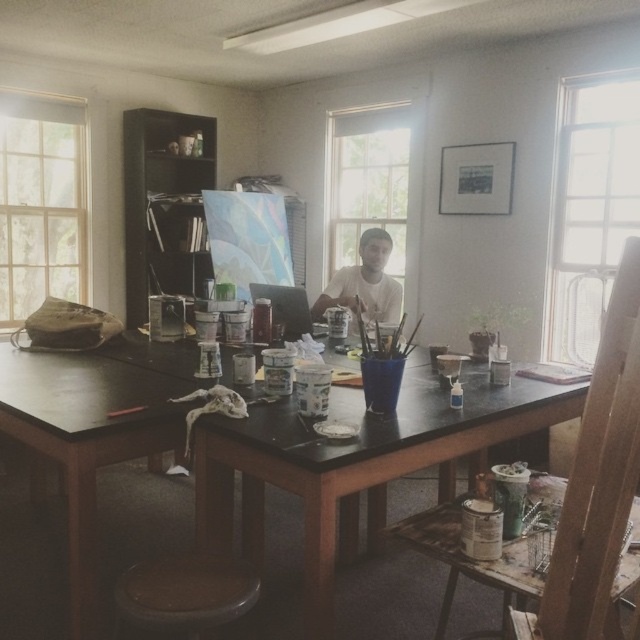
Question: Can you confirm if brown wooden stool at lower center is wider than white matte shirt at center?

Choices:
 (A) yes
 (B) no

Answer: (B)

Question: Can you confirm if black matte table at center is positioned to the left of white matte shirt at center?

Choices:
 (A) yes
 (B) no

Answer: (A)

Question: Among these points, which one is nearest to the camera?

Choices:
 (A) (396, 298)
 (B) (202, 582)

Answer: (B)

Question: Which object appears closest to the camera in this image?

Choices:
 (A) brown wooden stool at lower center
 (B) black matte table at center
 (C) white matte shirt at center

Answer: (A)

Question: Is black matte table at center positioned in front of white matte shirt at center?

Choices:
 (A) yes
 (B) no

Answer: (A)

Question: Which of these objects is positioned closest to the white matte shirt at center?

Choices:
 (A) brown wooden stool at lower center
 (B) black matte table at center

Answer: (B)